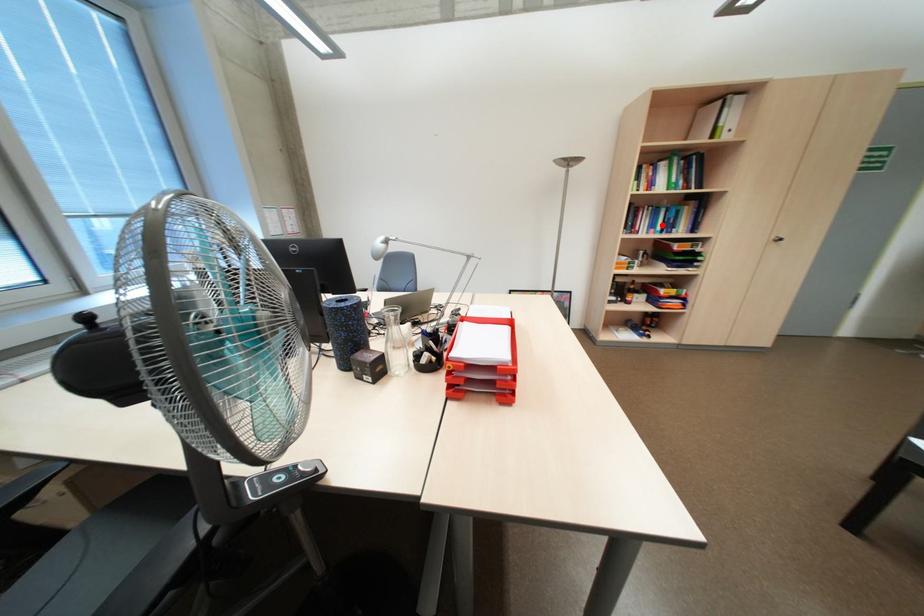
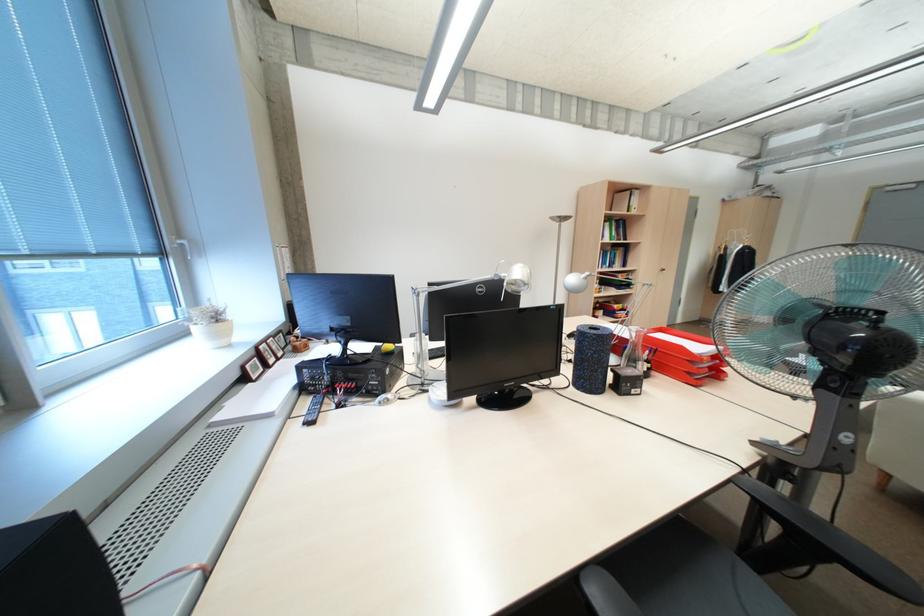
The point at the highlighted location is marked in the first image. Where is the corresponding point in the second image?

(614, 262)